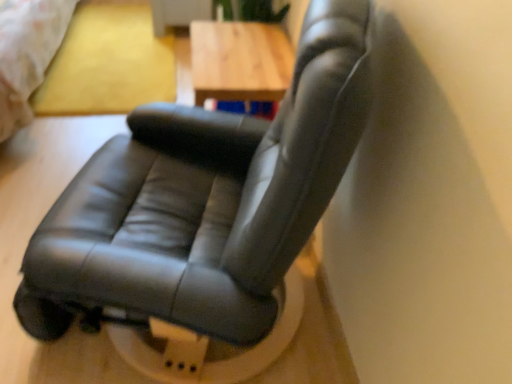
Question: Is black leather chair at center situated inside matte yellow bed at upper left or outside?

Choices:
 (A) inside
 (B) outside

Answer: (B)

Question: From the image's perspective, relative to matte yellow bed at upper left, is black leather chair at center above or below?

Choices:
 (A) below
 (B) above

Answer: (A)

Question: Which is nearer to the black leather chair at center?

Choices:
 (A) matte yellow bed at upper left
 (B) wooden table at center

Answer: (B)

Question: Considering the real-world distances, which object is farthest from the black leather chair at center?

Choices:
 (A) matte yellow bed at upper left
 (B) wooden table at center

Answer: (A)